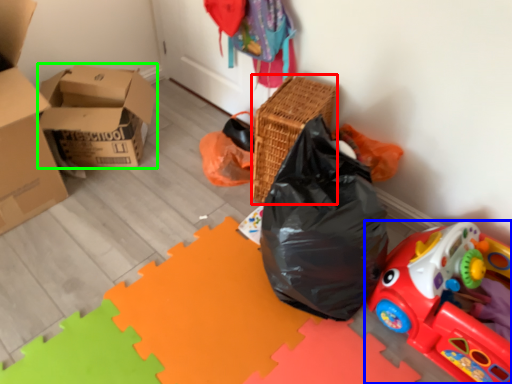
Question: Based on their relative distances, which object is farther from basket (highlighted by a red box)? Choose from toy (highlighted by a blue box) and box (highlighted by a green box).

Choices:
 (A) toy
 (B) box

Answer: (B)